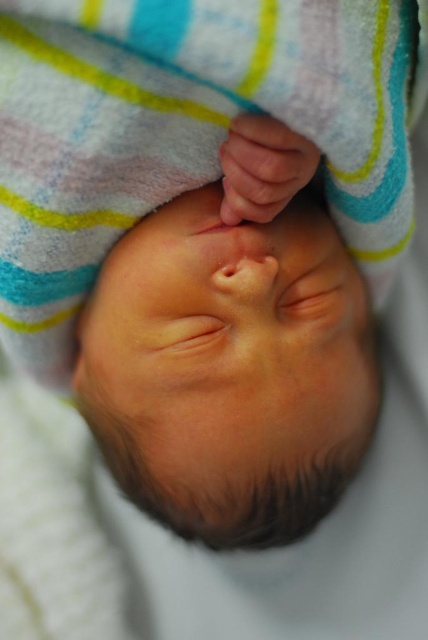
Question: Can you confirm if smooth skin head at center is wider than smooth skin hand at upper center?

Choices:
 (A) no
 (B) yes

Answer: (B)

Question: Which object appears closest to the camera in this image?

Choices:
 (A) smooth skin head at center
 (B) smooth skin hand at upper center

Answer: (B)

Question: Among these objects, which one is nearest to the camera?

Choices:
 (A) smooth skin hand at upper center
 (B) smooth skin head at center

Answer: (A)

Question: Which object is closer to the camera taking this photo?

Choices:
 (A) smooth skin hand at upper center
 (B) smooth skin head at center

Answer: (A)

Question: Is smooth skin head at center further to camera compared to smooth skin hand at upper center?

Choices:
 (A) no
 (B) yes

Answer: (B)

Question: Is smooth skin head at center further to camera compared to smooth skin hand at upper center?

Choices:
 (A) no
 (B) yes

Answer: (B)